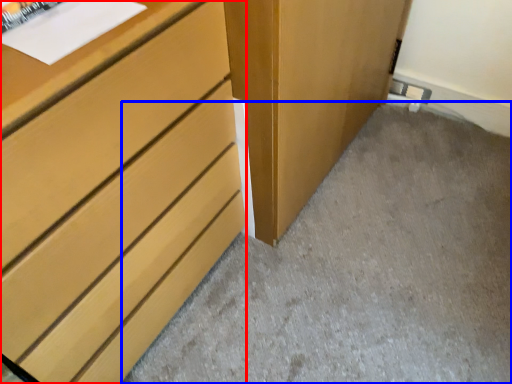
Question: Among these objects, which one is nearest to the camera, chest of drawers (highlighted by a red box) or concrete (highlighted by a blue box)?

Choices:
 (A) chest of drawers
 (B) concrete

Answer: (A)